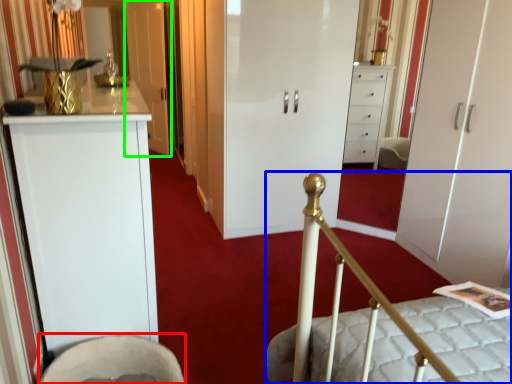
Question: Considering the real-world distances, which object is farthest from rocking chair (highlighted by a red box)? bed (highlighted by a blue box) or door (highlighted by a green box)?

Choices:
 (A) bed
 (B) door

Answer: (B)